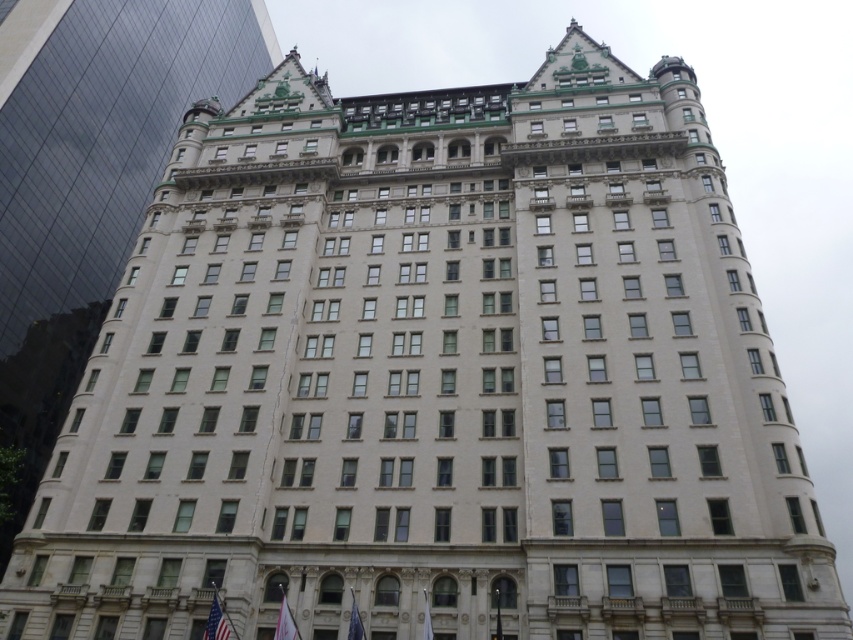
Can you confirm if blue fabric flag at lower center is shorter than white fabric flag at center?

Result: No.

Is point (358, 625) farther from camera compared to point (425, 634)?

Yes, it is.

This screenshot has width=853, height=640. What do you see at coordinates (355, 621) in the screenshot?
I see `blue fabric flag at lower center` at bounding box center [355, 621].

Locate an element on the screen. blue fabric flag at lower center is located at coordinates (355, 621).

Looking at this image, is american flag at lower left positioned behind white fabric flag at lower center?

Yes, it is behind white fabric flag at lower center.

Is american flag at lower left wider than white fabric flag at lower center?

Yes, american flag at lower left is wider than white fabric flag at lower center.

This screenshot has width=853, height=640. What do you see at coordinates (216, 620) in the screenshot?
I see `american flag at lower left` at bounding box center [216, 620].

Identify the location of american flag at lower left. The image size is (853, 640). (216, 620).

Consider the image. Is american flag at lower left positioned in front of white fabric flag at center?

No, it is not.

Can you confirm if american flag at lower left is taller than white fabric flag at center?

Yes.

Between point (212, 600) and point (427, 634), which one is positioned behind?

The point (212, 600) is behind.

At what (x,y) coordinates should I click in order to perform the action: click on american flag at lower left. Please return your answer as a coordinate pair (x, y). Looking at the image, I should click on pyautogui.click(x=216, y=620).